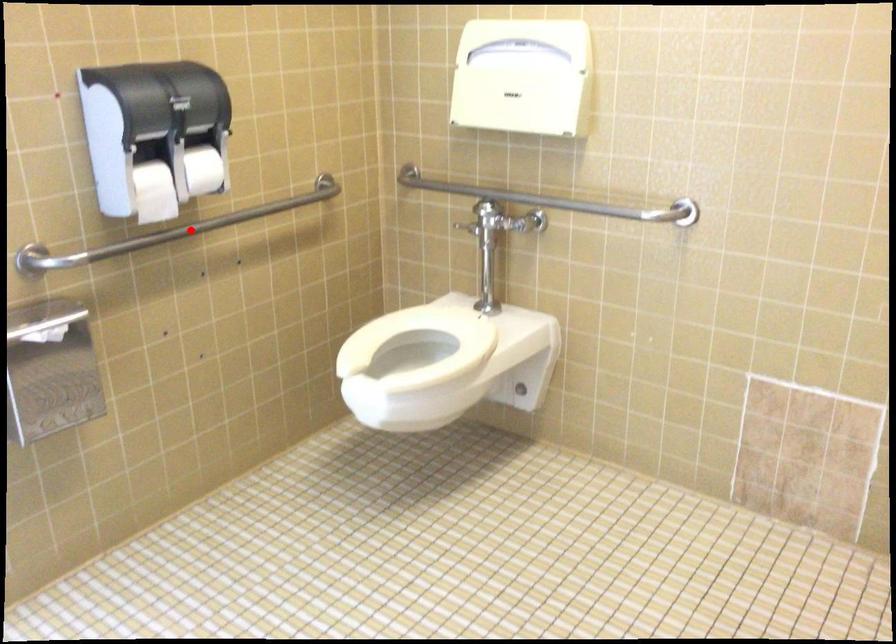
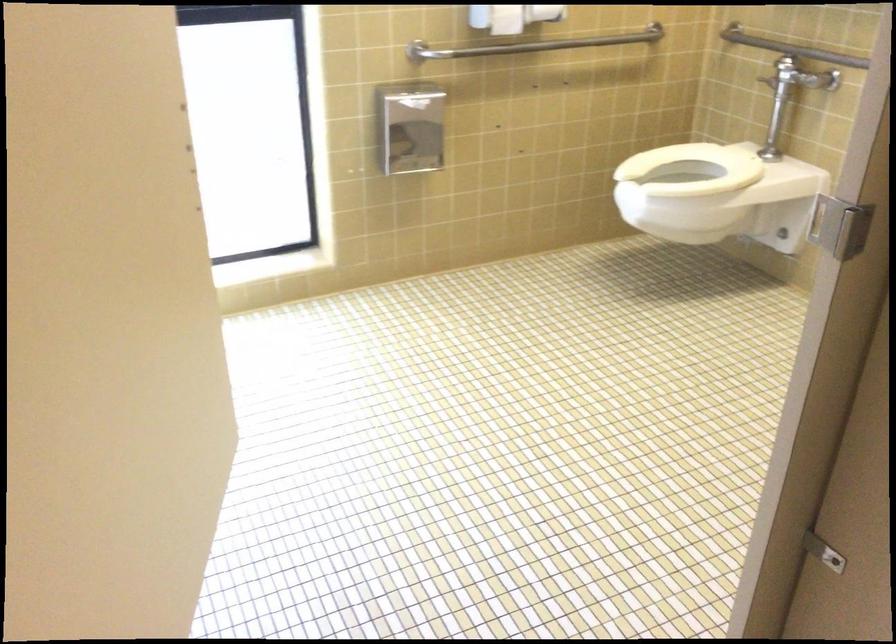
Question: A red point is marked in image1. In image2, is the corresponding 3D point closer to the camera or farther? Reply with the corresponding letter.

Choices:
 (A) The corresponding 3D point is closer.
 (B) The corresponding 3D point is farther.

Answer: (B)